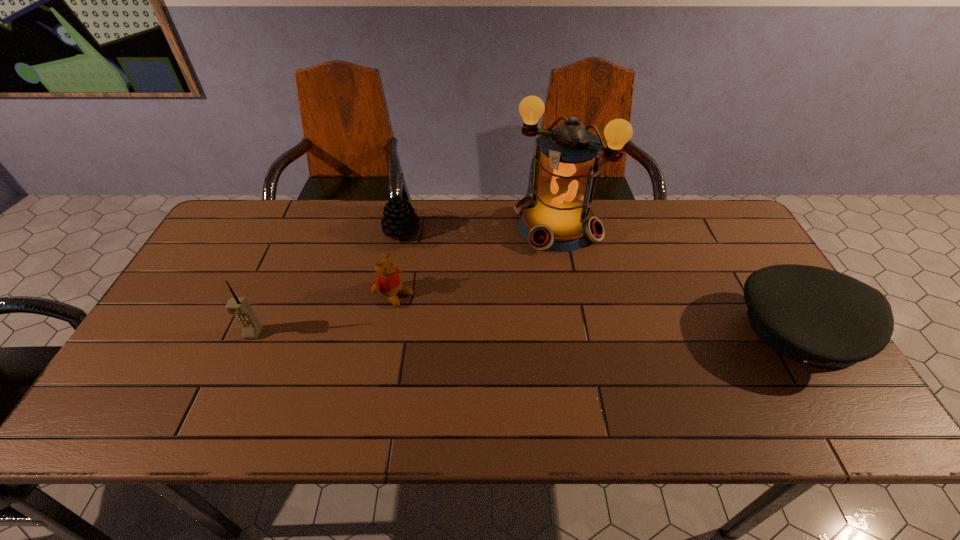
This screenshot has height=540, width=960. Identify the location of vacant space on the desktop that is between the leftmost object and the beret and is positioned on the front-facing side of the teddy bear. (456, 333).

I want to click on free spot on the desktop that is between the second tallest object and the beret and is positioned on the front-facing side of the tallest object, so click(x=468, y=333).

Locate an element on the screen. The height and width of the screenshot is (540, 960). vacant space on the desktop that is between the second tallest object and the rightmost object and is positioned at the narrow end of the pinecone is located at coordinates (452, 333).